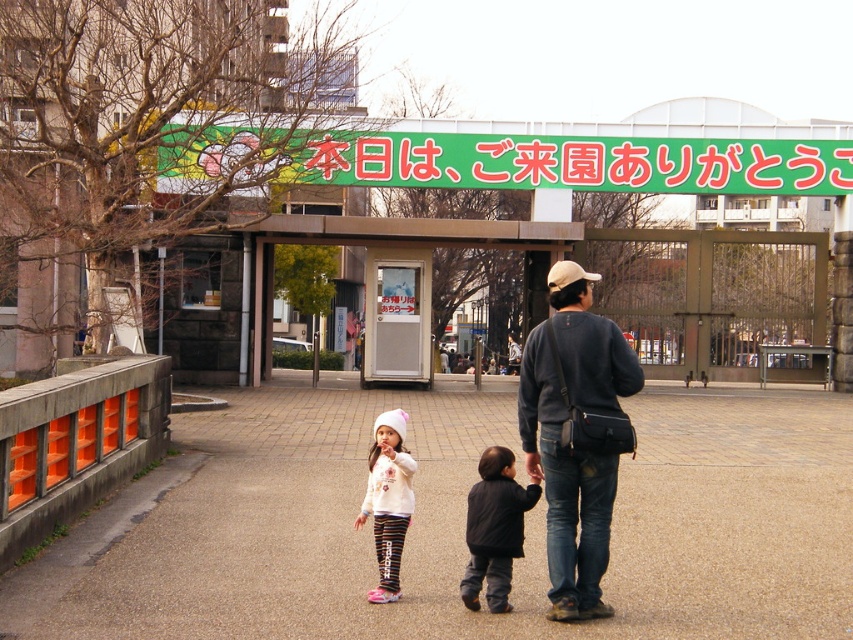
Question: Is brown concrete pavement at center behind dark gray sweater at center?

Choices:
 (A) yes
 (B) no

Answer: (B)

Question: Which object is the farthest from the dark gray sweater at center?

Choices:
 (A) black soft jacket at center
 (B) brown concrete pavement at center

Answer: (B)

Question: Which point is farther to the camera?

Choices:
 (A) (379, 465)
 (B) (560, 582)
 (C) (751, 467)

Answer: (C)

Question: Is brown concrete pavement at center smaller than dark gray sweater at center?

Choices:
 (A) no
 (B) yes

Answer: (A)

Question: Can you confirm if brown concrete pavement at center is wider than white soft hat at center?

Choices:
 (A) no
 (B) yes

Answer: (B)

Question: Which object is positioned closest to the white soft hat at center?

Choices:
 (A) black soft jacket at center
 (B) dark gray sweater at center

Answer: (A)